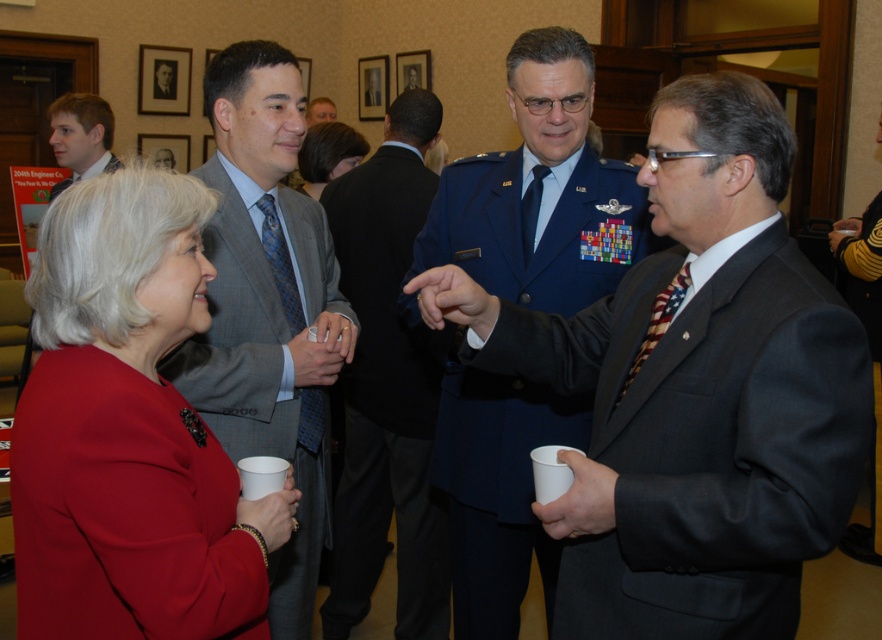
Who is shorter, yellow striped sweater at lower right or dark brown hair at center?

With less height is dark brown hair at center.

Can you confirm if yellow striped sweater at lower right is positioned below dark brown hair at center?

Indeed, yellow striped sweater at lower right is positioned under dark brown hair at center.

Is point (857, 548) positioned behind point (329, 145)?

Yes, point (857, 548) is farther from viewer.

The width and height of the screenshot is (882, 640). Find the location of `yellow striped sweater at lower right`. yellow striped sweater at lower right is located at coordinates (861, 268).

Who is positioned more to the right, blue uniform at center or matte black suit at center?

Positioned to the right is blue uniform at center.

Which is below, blue uniform at center or matte black suit at center?

blue uniform at center is below.

Locate an element on the screen. Image resolution: width=882 pixels, height=640 pixels. blue uniform at center is located at coordinates (542, 193).

Identify the location of blue uniform at center. (542, 193).

Which is behind, point (866, 252) or point (308, 120)?

Positioned behind is point (308, 120).

Does yellow striped sweater at lower right have a lesser height compared to matte black suit at center?

No.

Where is `yellow striped sweater at lower right`? yellow striped sweater at lower right is located at coordinates point(861,268).